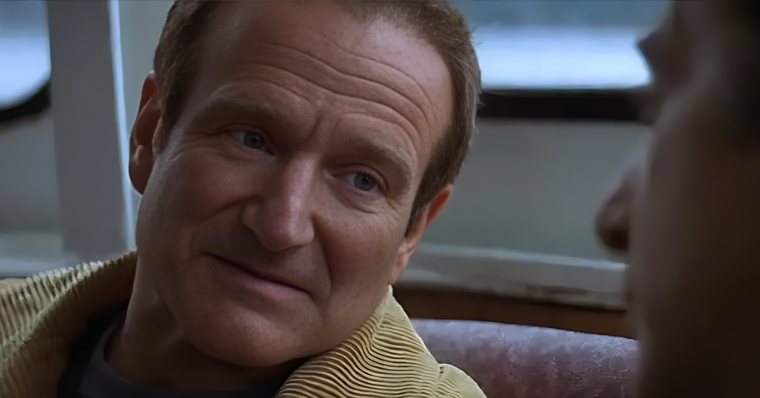
The width and height of the screenshot is (760, 398). I want to click on couch, so click(517, 363).